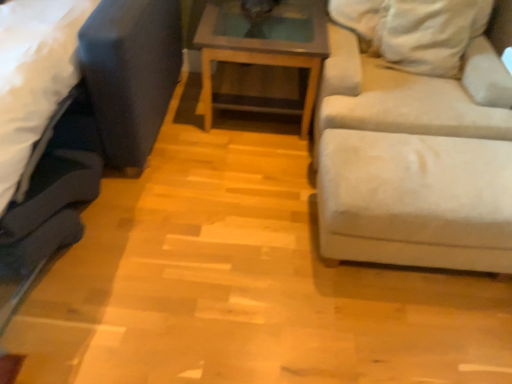
Question: Can you confirm if velvet dark blue studio couch at left, acting as the first studio couch starting from the left, is taller than wooden glass top table at center?

Choices:
 (A) no
 (B) yes

Answer: (B)

Question: From the image's perspective, is velvet dark blue studio couch at left, acting as the first studio couch starting from the left, located above wooden glass top table at center?

Choices:
 (A) yes
 (B) no

Answer: (B)

Question: From a real-world perspective, is velvet dark blue studio couch at left, acting as the first studio couch starting from the left, on wooden glass top table at center?

Choices:
 (A) yes
 (B) no

Answer: (A)

Question: Considering the relative positions of velvet dark blue studio couch at left, the 2th studio couch positioned from the right, and wooden glass top table at center in the image provided, is velvet dark blue studio couch at left, the 2th studio couch positioned from the right, to the left of wooden glass top table at center from the viewer's perspective?

Choices:
 (A) yes
 (B) no

Answer: (A)

Question: From the image's perspective, does velvet dark blue studio couch at left, the 2th studio couch positioned from the right, appear lower than wooden glass top table at center?

Choices:
 (A) no
 (B) yes

Answer: (B)

Question: Is velvet dark blue studio couch at left, the 2th studio couch positioned from the right, next to wooden glass top table at center and touching it?

Choices:
 (A) no
 (B) yes

Answer: (A)

Question: Does wooden glass top table at center have a smaller size compared to velvet dark blue studio couch at left, acting as the first studio couch starting from the left?

Choices:
 (A) no
 (B) yes

Answer: (B)

Question: Does wooden glass top table at center have a greater height compared to velvet dark blue studio couch at left, the 2th studio couch positioned from the right?

Choices:
 (A) yes
 (B) no

Answer: (B)

Question: Can you confirm if wooden glass top table at center is thinner than velvet dark blue studio couch at left, acting as the first studio couch starting from the left?

Choices:
 (A) yes
 (B) no

Answer: (A)

Question: Considering the relative sizes of wooden glass top table at center and velvet dark blue studio couch at left, the 2th studio couch positioned from the right, in the image provided, is wooden glass top table at center wider than velvet dark blue studio couch at left, the 2th studio couch positioned from the right,?

Choices:
 (A) no
 (B) yes

Answer: (A)

Question: Is wooden glass top table at center located outside velvet dark blue studio couch at left, acting as the first studio couch starting from the left?

Choices:
 (A) no
 (B) yes

Answer: (B)

Question: From a real-world perspective, does wooden glass top table at center stand above velvet dark blue studio couch at left, acting as the first studio couch starting from the left?

Choices:
 (A) yes
 (B) no

Answer: (B)

Question: Does wooden glass top table at center have a larger size compared to beige fabric couch at right, positioned as the first studio couch in right-to-left order?

Choices:
 (A) no
 (B) yes

Answer: (A)